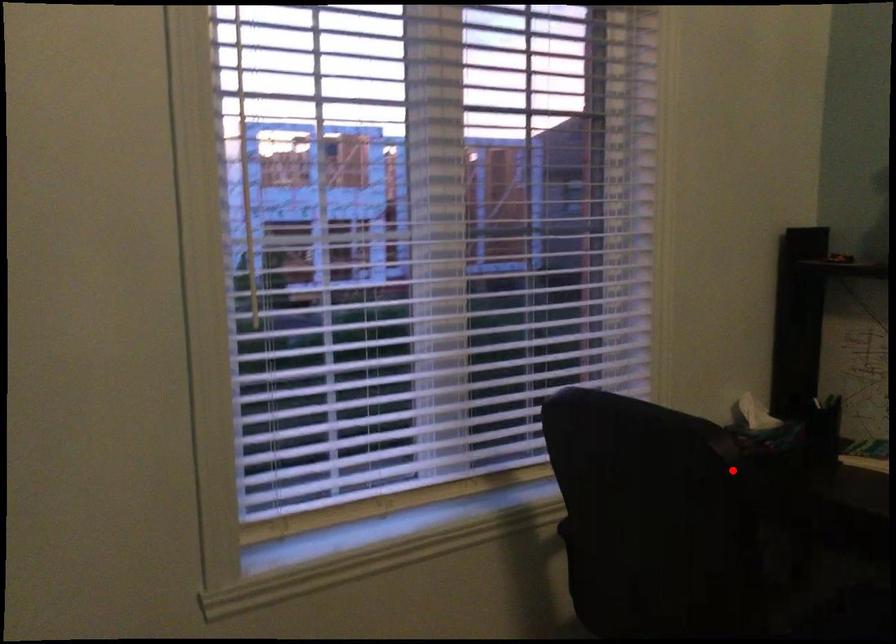
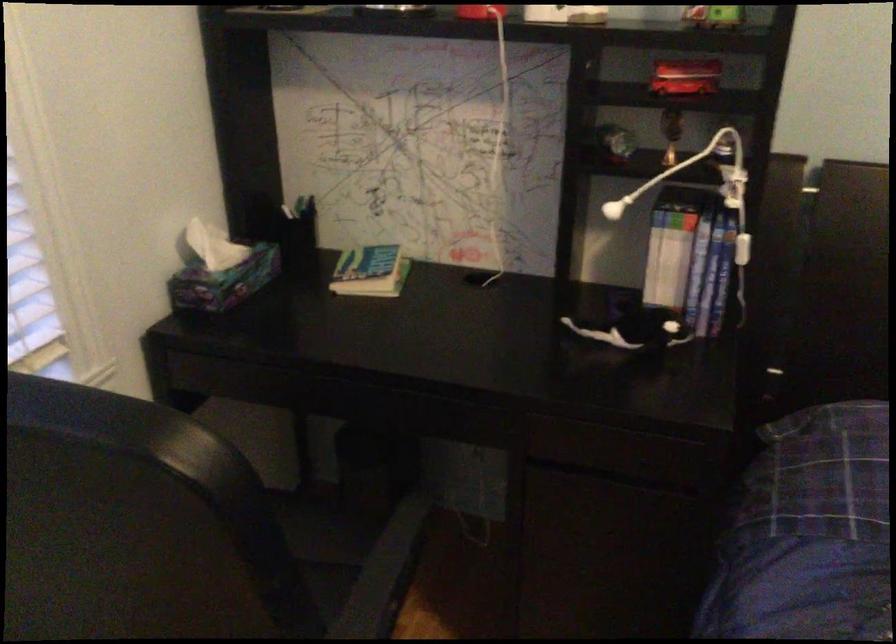
Locate, in the second image, the point that corresponds to the highlighted location in the first image.

(234, 509)